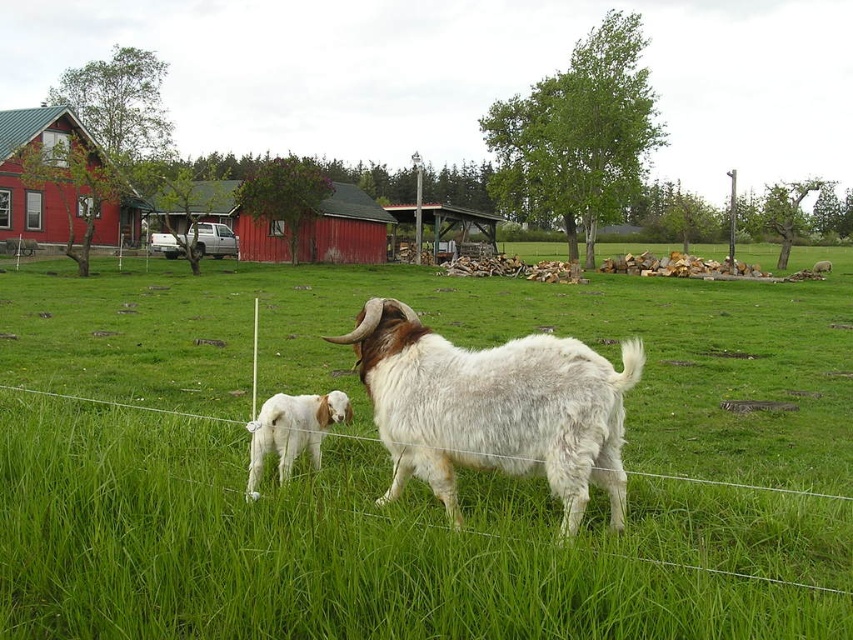
Is point (71, 211) closer to camera compared to point (280, 454)?

No, it is behind (280, 454).

The height and width of the screenshot is (640, 853). Describe the element at coordinates (44, 173) in the screenshot. I see `red wooden barn at left` at that location.

Is point (105, 196) positioned behind point (271, 403)?

Yes, it is.

The image size is (853, 640). In order to click on red wooden barn at left in this screenshot , I will do point(44,173).

Does green grassy field at center have a greater height compared to white woolen goat at center?

Yes.

Does point (701, 340) lie behind point (387, 336)?

Yes, point (701, 340) is farther from viewer.

At what (x,y) coordinates should I click in order to perform the action: click on green grassy field at center. Please return your answer as a coordinate pair (x, y). The image size is (853, 640). Looking at the image, I should click on (413, 481).

Can you confirm if green grassy field at center is bigger than white woolen goat at lower left?

Correct, green grassy field at center is larger in size than white woolen goat at lower left.

Between point (22, 534) and point (247, 486), which one is positioned in front?

Point (22, 534) is more forward.

Is point (741, 301) closer to viewer compared to point (260, 445)?

No, (741, 301) is behind (260, 445).

Where is `green grassy field at center`? The image size is (853, 640). green grassy field at center is located at coordinates (413, 481).